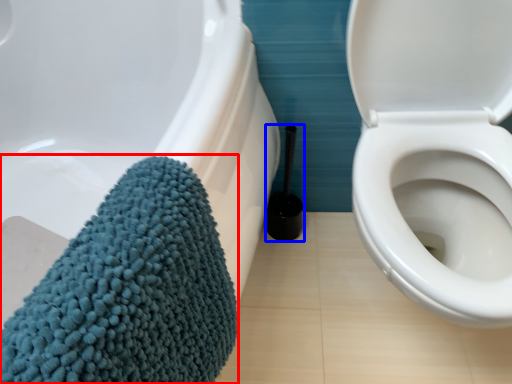
Question: Which object appears farthest to the camera in this image, bath towel (highlighted by a red box) or brush (highlighted by a blue box)?

Choices:
 (A) bath towel
 (B) brush

Answer: (B)